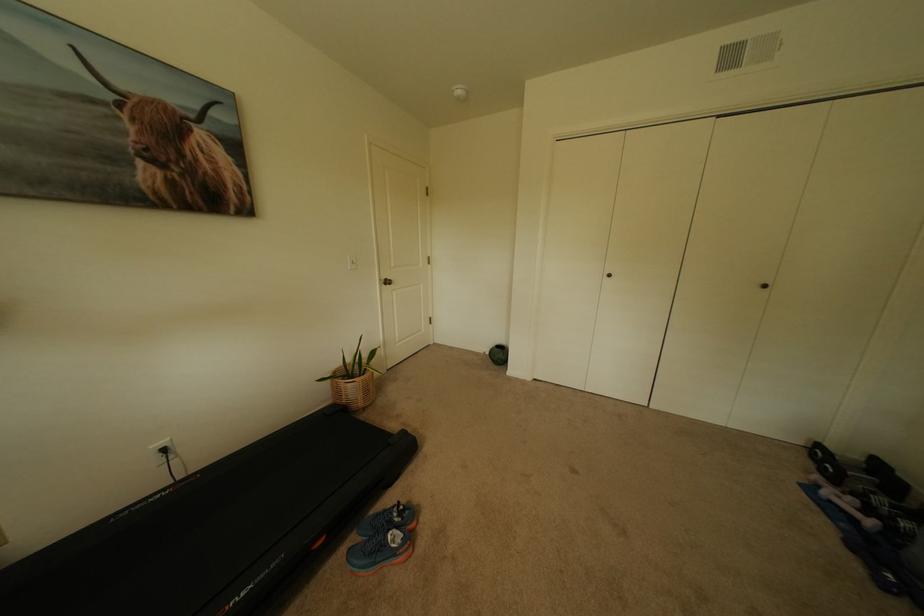
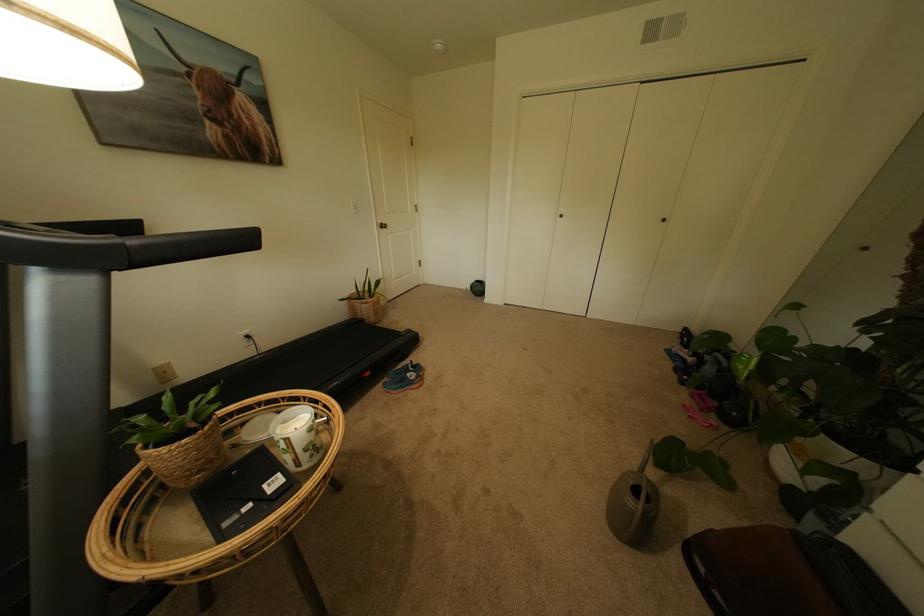
In the second image, find the point that corresponds to point 491,353 in the first image.

(473, 289)